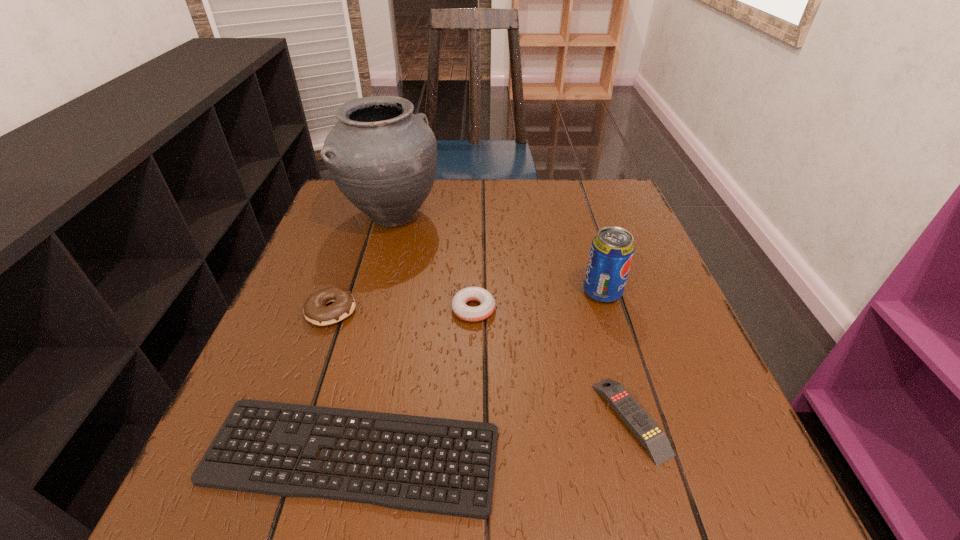
The image size is (960, 540). I want to click on blank space located on the back of the soda, so click(x=580, y=217).

The image size is (960, 540). Find the location of `vacant area situated 0.370m on the back of the fourth shortest object`. vacant area situated 0.370m on the back of the fourth shortest object is located at coordinates (371, 200).

Locate an element on the screen. vacant space located on the front of the fourth tallest object is located at coordinates (471, 469).

Image resolution: width=960 pixels, height=540 pixels. Identify the location of free space located 0.060m on the back of the remote control. (612, 350).

Find the location of a particular element. The width and height of the screenshot is (960, 540). vacant space located on the right of the shortest object is located at coordinates (648, 455).

Image resolution: width=960 pixels, height=540 pixels. I want to click on object that is at the far edge, so click(383, 158).

Where is `remote control that is positioned at the near edge`? The image size is (960, 540). remote control that is positioned at the near edge is located at coordinates (651, 436).

Where is `computer keyboard at the near edge`? The image size is (960, 540). computer keyboard at the near edge is located at coordinates (208, 474).

The image size is (960, 540). Find the location of `urn located at the left edge`. urn located at the left edge is located at coordinates (383, 158).

The width and height of the screenshot is (960, 540). I want to click on doughnut present at the left edge, so click(315, 310).